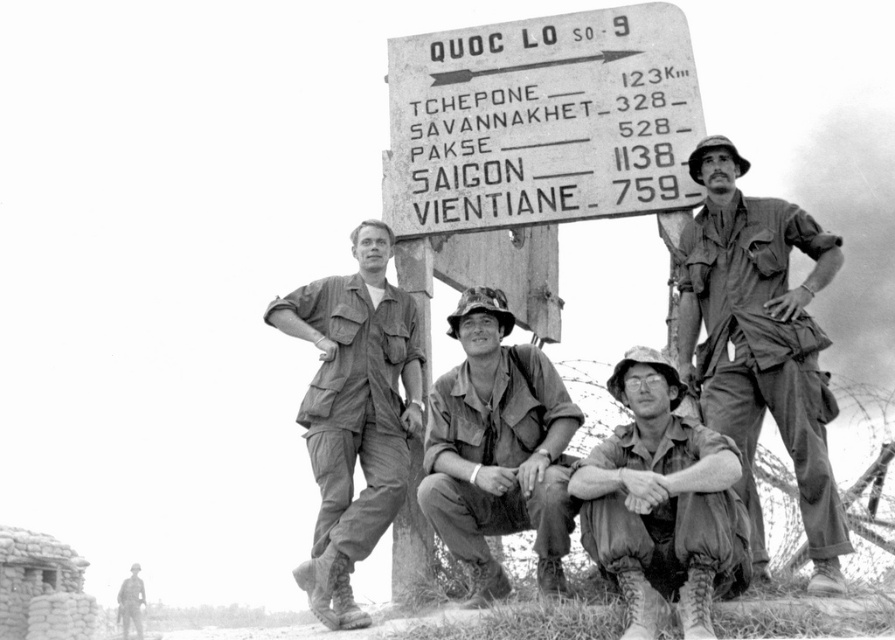
Between matte khaki uniform at right and camouflage uniform at lower left, which one has less height?

Standing shorter between the two is camouflage uniform at lower left.

Is matte khaki uniform at right above camouflage uniform at lower left?

Yes, matte khaki uniform at right is above camouflage uniform at lower left.

Is point (712, 330) more distant than point (126, 637)?

No, it is in front of (126, 637).

Find the location of a particular element. The height and width of the screenshot is (640, 895). matte khaki uniform at right is located at coordinates (760, 342).

Is stone signpost at center wider than camouflage fabric pants at lower center?

Yes, stone signpost at center is wider than camouflage fabric pants at lower center.

Is stone signpost at center in front of camouflage fabric pants at lower center?

No, stone signpost at center is behind camouflage fabric pants at lower center.

Who is more forward, (420, 193) or (723, 573)?

Positioned in front is point (723, 573).

You are a GUI agent. You are given a task and a screenshot of the screen. Output one action in this format:
    pyautogui.click(x=<x>, y=<y>)
    Task: Click on the stone signpost at center
    The height and width of the screenshot is (640, 895).
    Given the screenshot: What is the action you would take?
    pyautogui.click(x=542, y=120)

Is stone signpost at center positioned before camouflage fabric uniform at center?

No, stone signpost at center is behind camouflage fabric uniform at center.

Who is taller, stone signpost at center or camouflage fabric uniform at center?

camouflage fabric uniform at center

Image resolution: width=895 pixels, height=640 pixels. Find the location of `stone signpost at center`. stone signpost at center is located at coordinates (542, 120).